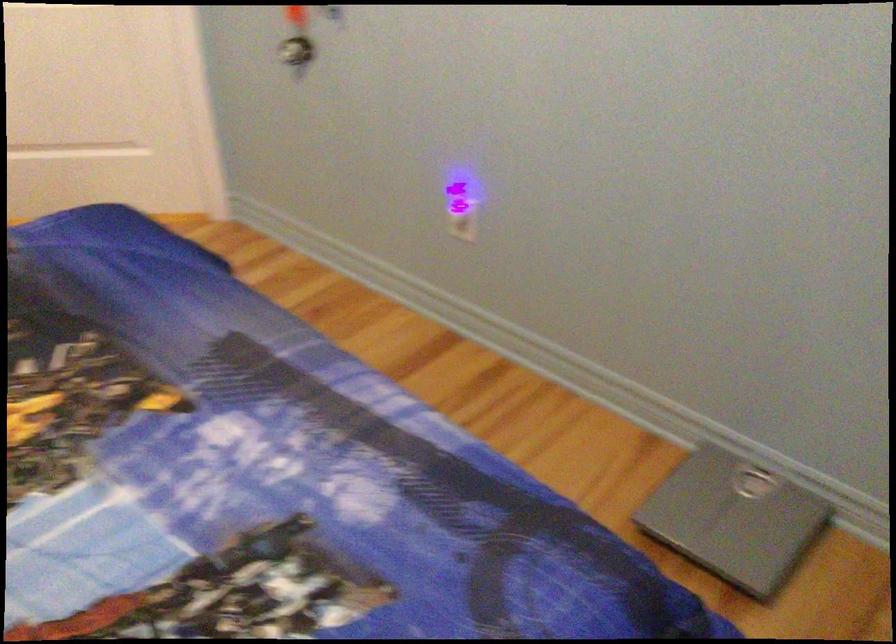
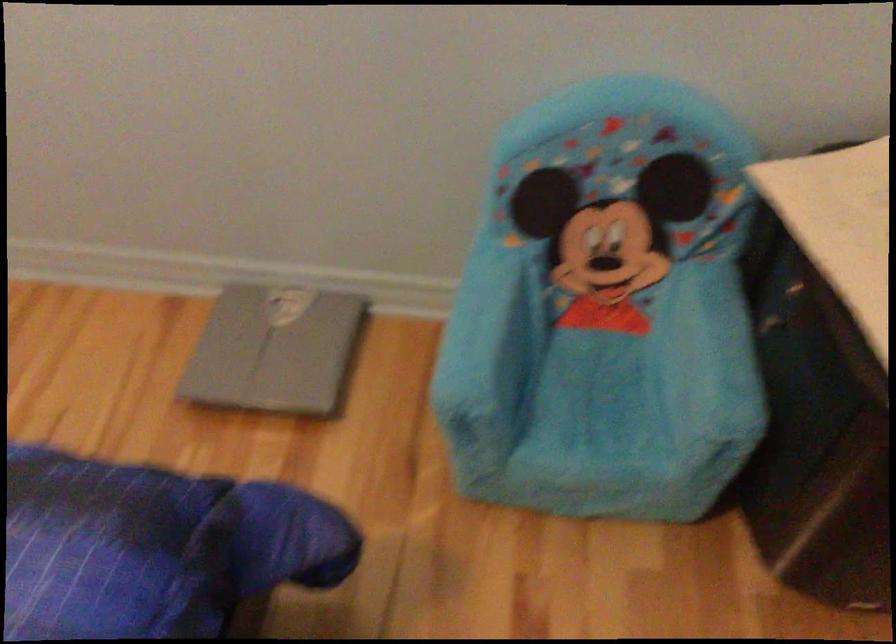
The first image is from the beginning of the video and the second image is from the end. How did the camera likely rotate when shooting the video?

The rotation direction of the camera is right-down.